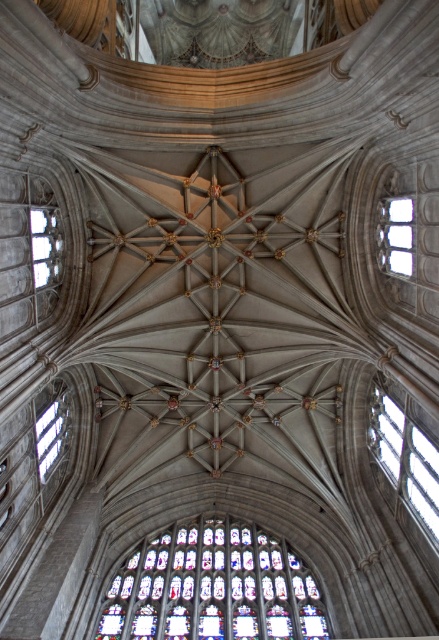
Question: Can you confirm if stained glass window at center is positioned above clear glass window at left?

Choices:
 (A) no
 (B) yes

Answer: (A)

Question: Considering the real-world distances, which object is closest to the stained glass window at center?

Choices:
 (A) clear glass window at center
 (B) clear glass window at left

Answer: (A)

Question: Considering the real-world distances, which object is farthest from the clear glass window at upper right?

Choices:
 (A) clear glass window at right
 (B) stained glass window at center
 (C) clear glass window at left
 (D) clear glass window at center

Answer: (D)

Question: Can you confirm if stained glass window at center is smaller than clear glass window at right?

Choices:
 (A) yes
 (B) no

Answer: (B)

Question: Is clear glass window at right to the left of clear glass window at center from the viewer's perspective?

Choices:
 (A) no
 (B) yes

Answer: (A)

Question: Which of the following is the closest to the observer?

Choices:
 (A) (399, 244)
 (B) (388, 428)
 (C) (32, 243)
 (D) (40, 481)

Answer: (C)